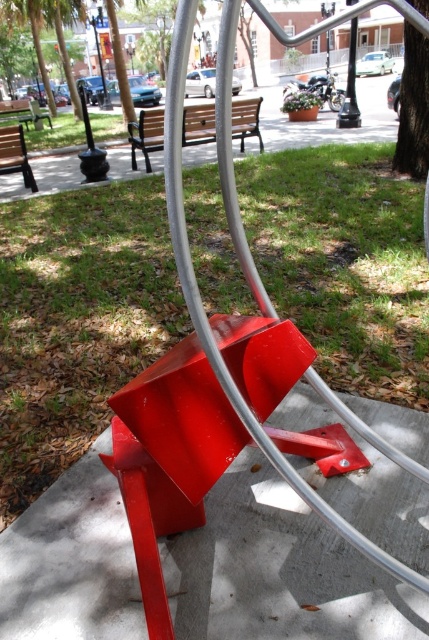
You are a maintenance worker holding a 1.5 meter long tool. You need to reach the glossy metal bench at center for inspection. Can you reach it without moving closer than 1.5 meters from the bench?

The distance between the glossy metal bench at center and the camera is 1.57 meters. Since your tool is 1.5 meters long, you can reach the bench by extending the tool fully while staying at least 1.5 meters away from the bench.

You are planning to host a small gathering and need seating for 6 people. You have access to the glossy metal bench at center and the wooden park bench at left. Which bench should you choose to accommodate more guests?

The glossy metal bench at center has a larger size compared to wooden park bench at left, so it can accommodate more guests.

You are a person who wants to sit on a bench that is taller than the other. Which bench should you choose between the glossy metal bench at center and the wooden park bench at left?

The wooden park bench at left is taller than the glossy metal bench at center, so you should choose the wooden park bench at left.